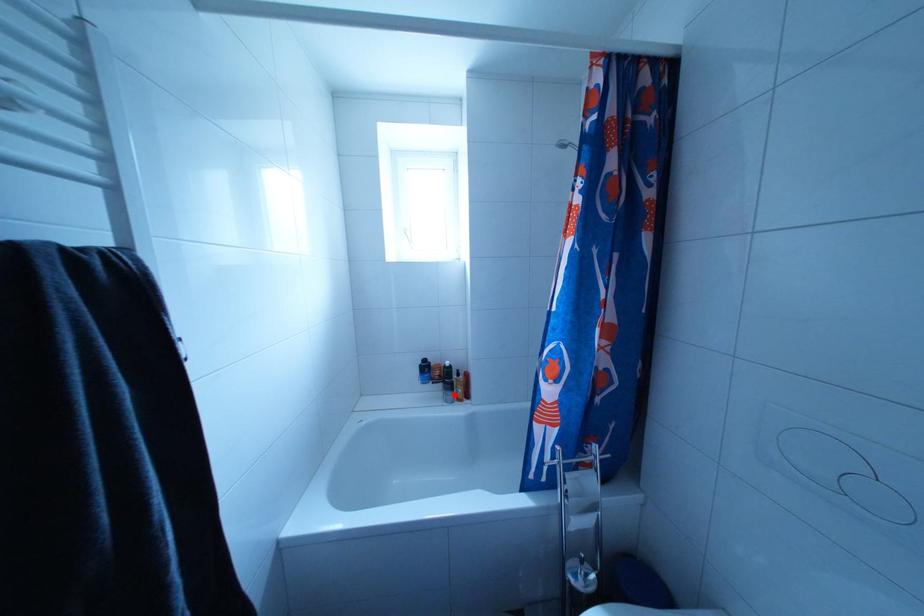
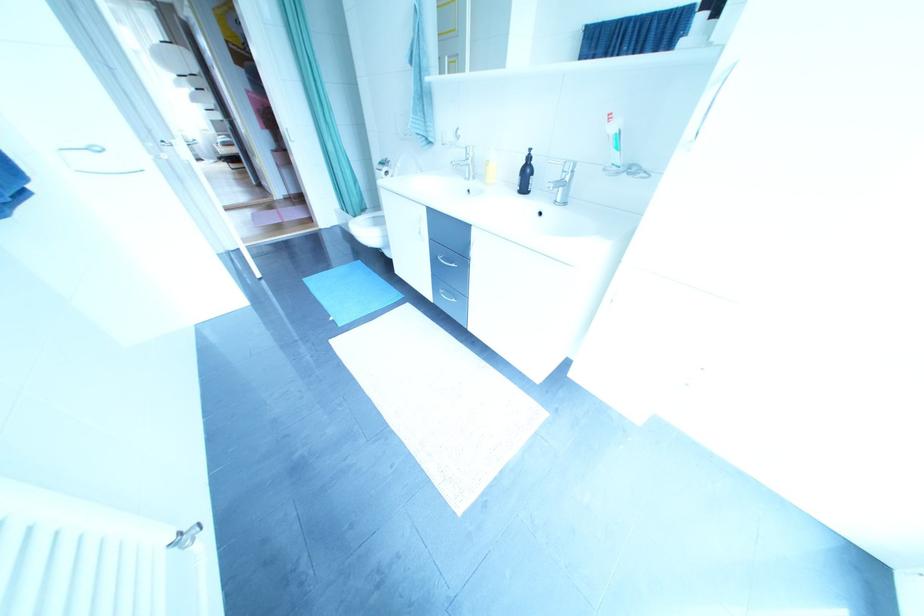
Question: I am providing you with two images of the same scene from different viewpoints. A red point is marked on the first image. Can you still see the location of the red point in image 2?

Choices:
 (A) Yes
 (B) No

Answer: (B)